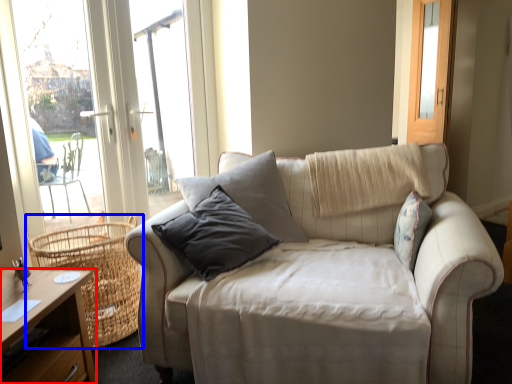
Question: Among these objects, which one is nearest to the camera, desk (highlighted by a red box) or basket (highlighted by a blue box)?

Choices:
 (A) desk
 (B) basket

Answer: (A)